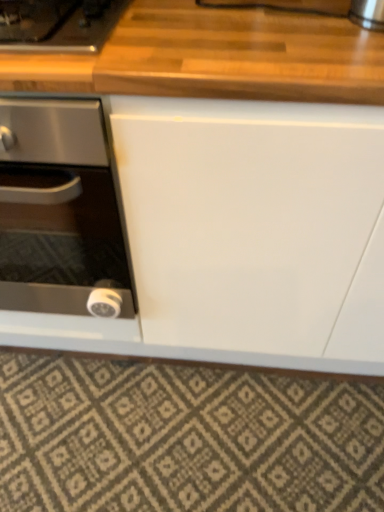
I want to click on empty space that is ontop of textured beige rug at lower center (from a real-world perspective), so click(x=178, y=431).